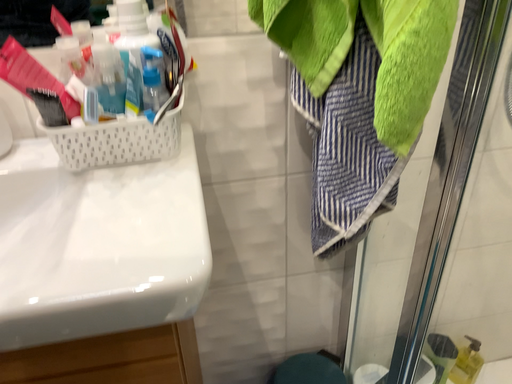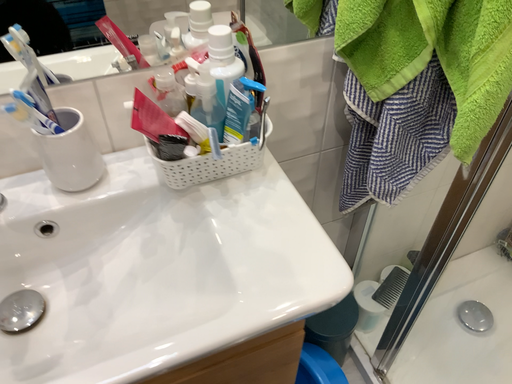
Question: Which way did the camera rotate in the video?

Choices:
 (A) rotated left
 (B) rotated right

Answer: (B)